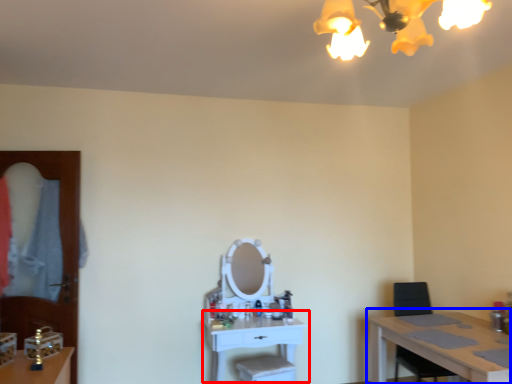
Question: Which point is further to the camera, table (highlighted by a red box) or table (highlighted by a blue box)?

Choices:
 (A) table
 (B) table

Answer: (A)